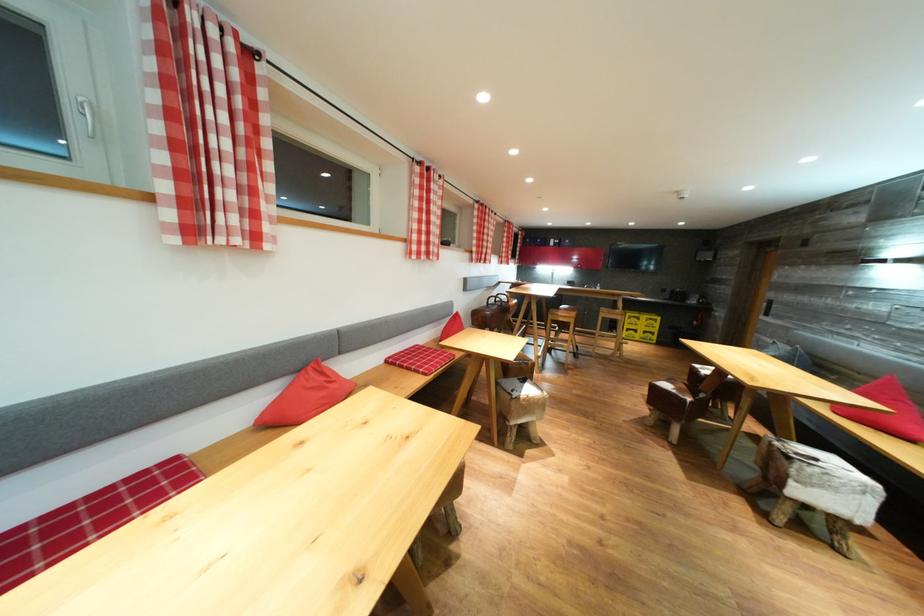
Locate an element on the screen. brown leather handle is located at coordinates (499, 299).